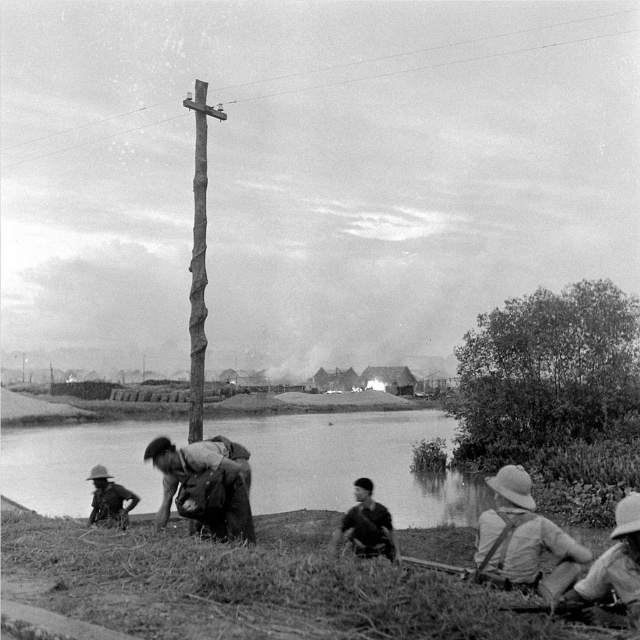
Does smooth water at lake center come in front of rough wood telegraph pole at center?

Yes, it is in front of rough wood telegraph pole at center.

Is smooth water at lake center taller than rough wood telegraph pole at center?

No, smooth water at lake center is not taller than rough wood telegraph pole at center.

Between point (260, 424) and point (202, 93), which one is positioned behind?

The point (260, 424) is more distant.

Identify the location of smooth water at lake center. The width and height of the screenshot is (640, 640). (353, 464).

Describe the element at coordinates (547, 372) in the screenshot. I see `thick foliage at right` at that location.

Who is more forward, (483, 333) or (196, 524)?

Point (196, 524) is in front.

Locate an element on the screen. This screenshot has height=640, width=640. thick foliage at right is located at coordinates (547, 372).

Is point (204, 529) positioned before point (189, 330)?

Yes.

Between dark brown fabric bag at lower center and rough wood telegraph pole at center, which one is positioned higher?

rough wood telegraph pole at center

Between point (227, 472) and point (196, 406), which one is positioned behind?

The point (196, 406) is behind.

Locate an element on the screen. This screenshot has height=640, width=640. dark brown fabric bag at lower center is located at coordinates [205, 484].